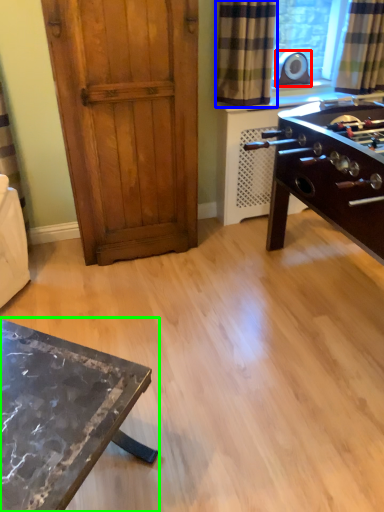
Question: Based on their relative distances, which object is farther from appliance (highlighted by a red box)? Choose from curtain (highlighted by a blue box) and table (highlighted by a green box).

Choices:
 (A) curtain
 (B) table

Answer: (B)